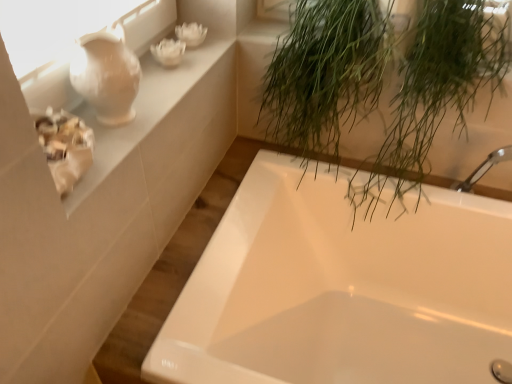
Question: Is point (281, 190) closer or farther from the camera than point (104, 72)?

Choices:
 (A) closer
 (B) farther

Answer: (B)

Question: Would you say white glossy bathtub at center is inside or outside matte white vase at upper left?

Choices:
 (A) inside
 (B) outside

Answer: (B)

Question: Estimate the real-world distances between objects in this image. Which object is closer to the white ceramic vase at upper left?

Choices:
 (A) white glossy bathtub at center
 (B) matte white vase at upper left
 (C) green leafy plant at upper right

Answer: (B)

Question: Estimate the real-world distances between objects in this image. Which object is farther from the white glossy bathtub at center?

Choices:
 (A) matte white vase at upper left
 (B) white ceramic vase at upper left
 (C) green leafy plant at upper right

Answer: (A)